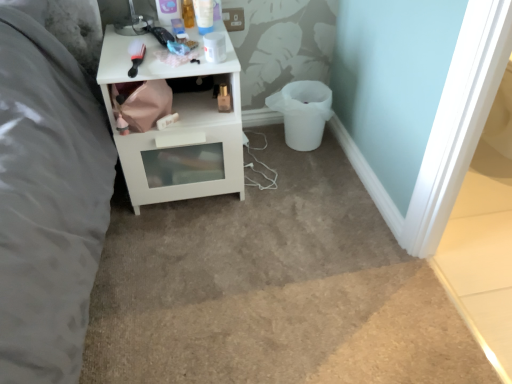
Question: From a real-world perspective, is white glossy nightstand at upper left above or below white plastic bucket at lower right?

Choices:
 (A) above
 (B) below

Answer: (A)

Question: In the image, is white glossy nightstand at upper left positioned in front of or behind white plastic bucket at lower right?

Choices:
 (A) front
 (B) behind

Answer: (A)

Question: From the image's perspective, is white glossy nightstand at upper left positioned above or below white plastic bucket at lower right?

Choices:
 (A) above
 (B) below

Answer: (B)

Question: Looking at the image, does white plastic bucket at lower right seem bigger or smaller compared to white glossy nightstand at upper left?

Choices:
 (A) small
 (B) big

Answer: (A)

Question: Considering the relative positions of white plastic bucket at lower right and white glossy nightstand at upper left in the image provided, is white plastic bucket at lower right to the left or to the right of white glossy nightstand at upper left?

Choices:
 (A) left
 (B) right

Answer: (B)

Question: From the image's perspective, is white plastic bucket at lower right above or below white glossy nightstand at upper left?

Choices:
 (A) above
 (B) below

Answer: (A)

Question: From a real-world perspective, is white plastic bucket at lower right above or below white glossy nightstand at upper left?

Choices:
 (A) below
 (B) above

Answer: (A)